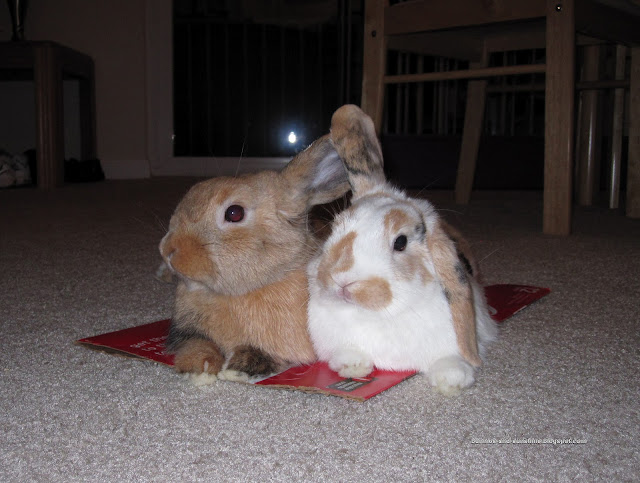
This screenshot has width=640, height=483. I want to click on speckled gray floor, so click(x=283, y=443).